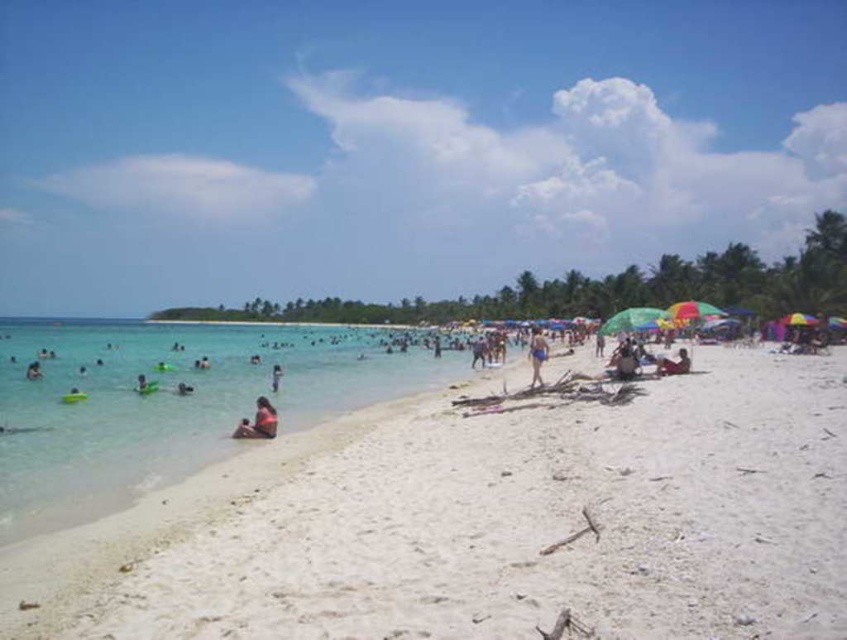
You are a photographer trying to capture the scene of the purple fabric bikini at center and the tan skin person at center. Which object is positioned in front of the other?

The purple fabric bikini at center is closer to the viewer than the tan skin person at center, so it is positioned in front of the tan skin person at center.

In the scene shown: You are a beachgoer who wants to swim in the turquoise waters but need to pass between the smooth skin person at center and the green plastic float at left. Can you walk through the space between them?

The smooth skin person at center is positioned on the right side of green plastic float at left, so there is space between them for you to walk through.

You are a photographer trying to capture a photo of the purple fabric bikini at center and the dark brown skin at lower right. Which object should you focus on first if you want to include both in the frame without moving the camera?

The purple fabric bikini at center is much taller than the dark brown skin at lower right, so you should focus on the purple fabric bikini at center first to ensure it fits within the frame.